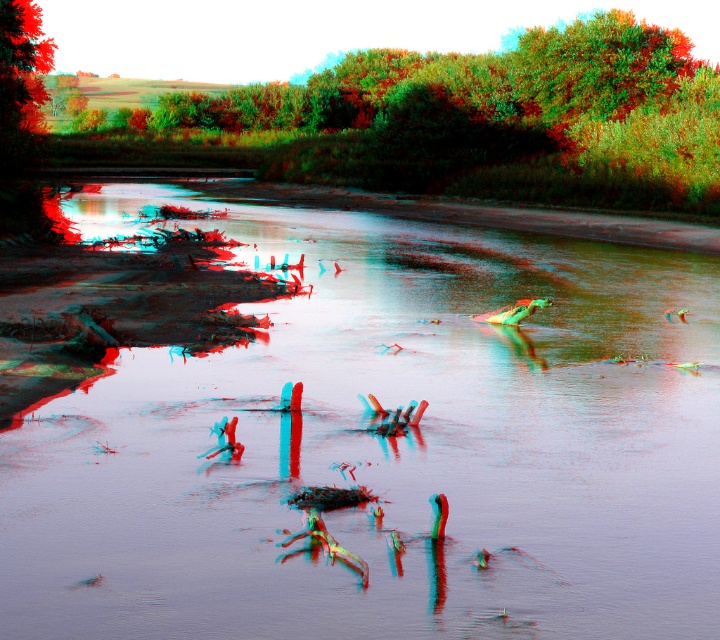
You are standing at the origin point of the coordinate system in this scene. Where is the translucent plastic river at center located in terms of coordinates?

The translucent plastic river at center is located at coordinates point (384,444).